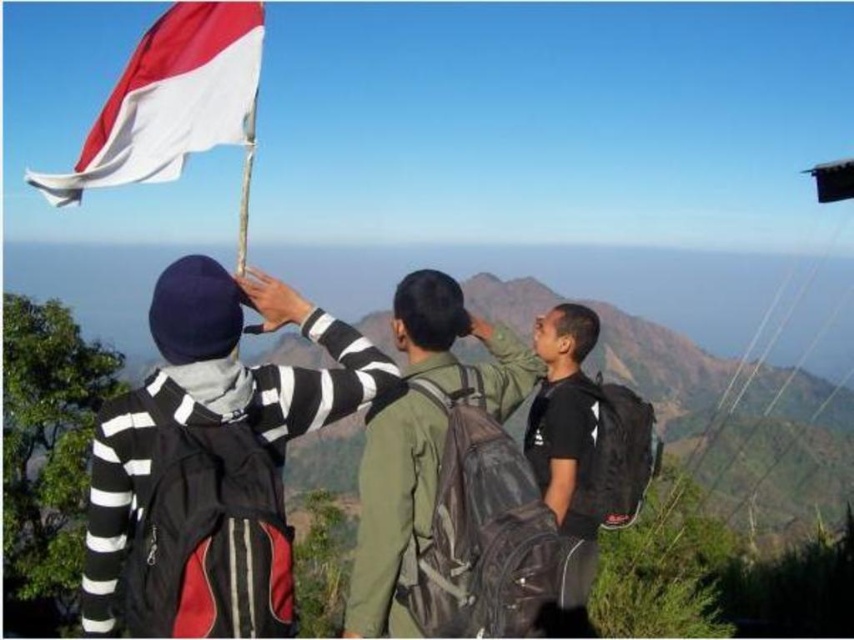
Between striped fabric sweater at left and red-white fabric flag at upper left, which one is positioned lower?

striped fabric sweater at left is lower down.

Is striped fabric sweater at left thinner than red-white fabric flag at upper left?

Correct, striped fabric sweater at left's width is less than red-white fabric flag at upper left's.

Who is more distant from viewer, (252,566) or (135,129)?

Positioned behind is point (135,129).

This screenshot has height=640, width=854. What are the coordinates of `striped fabric sweater at left` in the screenshot? It's located at (214, 456).

Based on the photo, which is above, red-white fabric flag at upper left or green matte jacket at center?

red-white fabric flag at upper left is higher up.

Find the location of `red-white fabric flag at upper left`. red-white fabric flag at upper left is located at coordinates (171, 99).

Describe the element at coordinates (171, 99) in the screenshot. This screenshot has height=640, width=854. I see `red-white fabric flag at upper left` at that location.

Locate an element on the screen. This screenshot has width=854, height=640. red-white fabric flag at upper left is located at coordinates (171, 99).

Is red-white fabric flag at upper left to the right of black matte backpack at center from the viewer's perspective?

Incorrect, red-white fabric flag at upper left is not on the right side of black matte backpack at center.

Which is behind, point (237, 64) or point (553, 403)?

Point (553, 403)

This screenshot has height=640, width=854. What are the coordinates of `red-white fabric flag at upper left` in the screenshot? It's located at (171, 99).